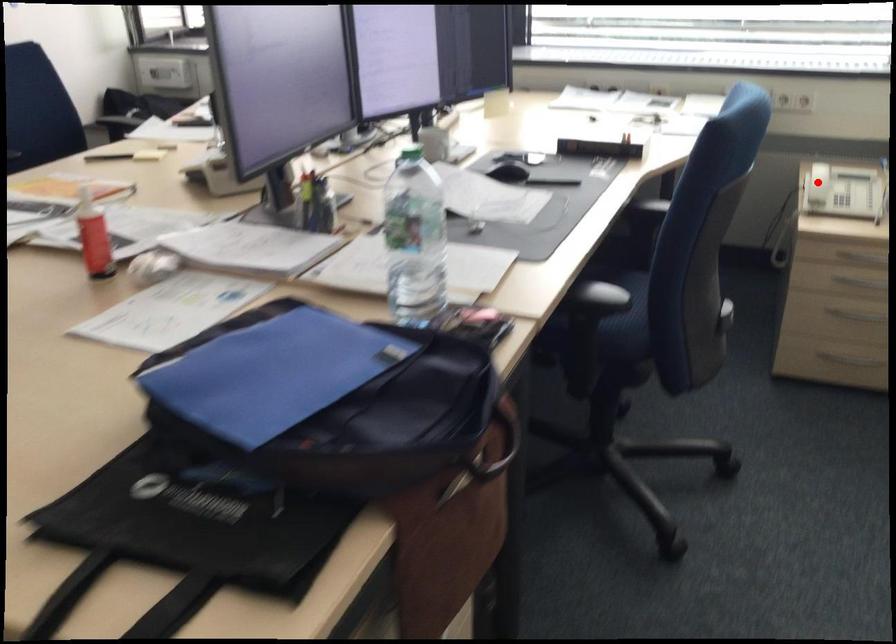
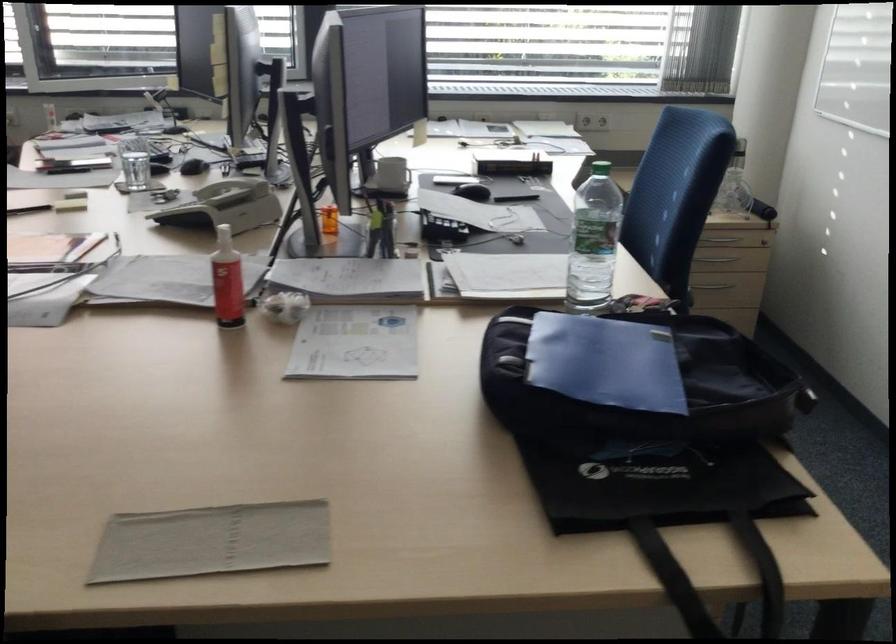
Question: I am providing you with two images of the same scene from different viewpoints. A red point is marked on the first image. Is the red point's position out of view in image 2?

Choices:
 (A) Yes
 (B) No

Answer: (A)